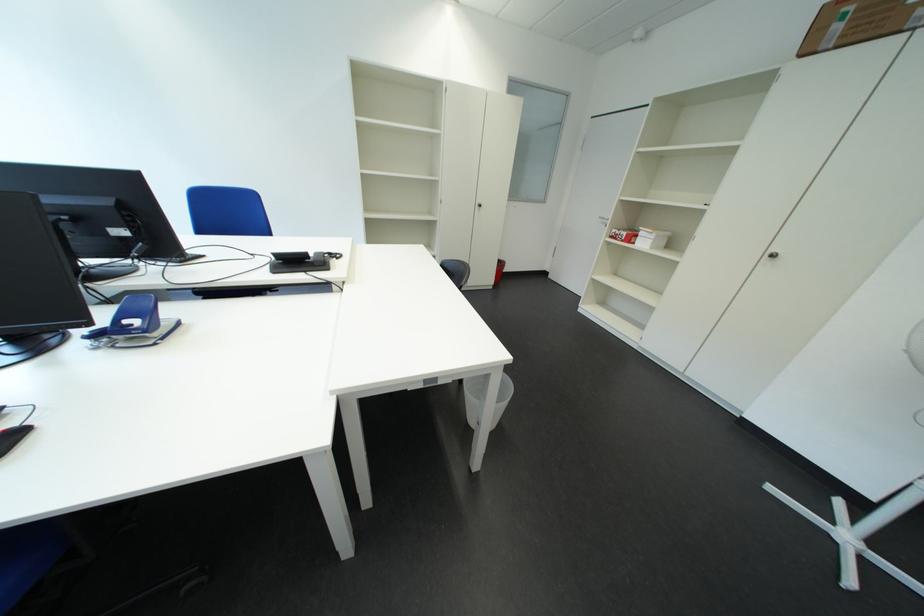
Where would you lift the small white box? Please return your answer as a coordinate pair (x, y).

(650, 238)